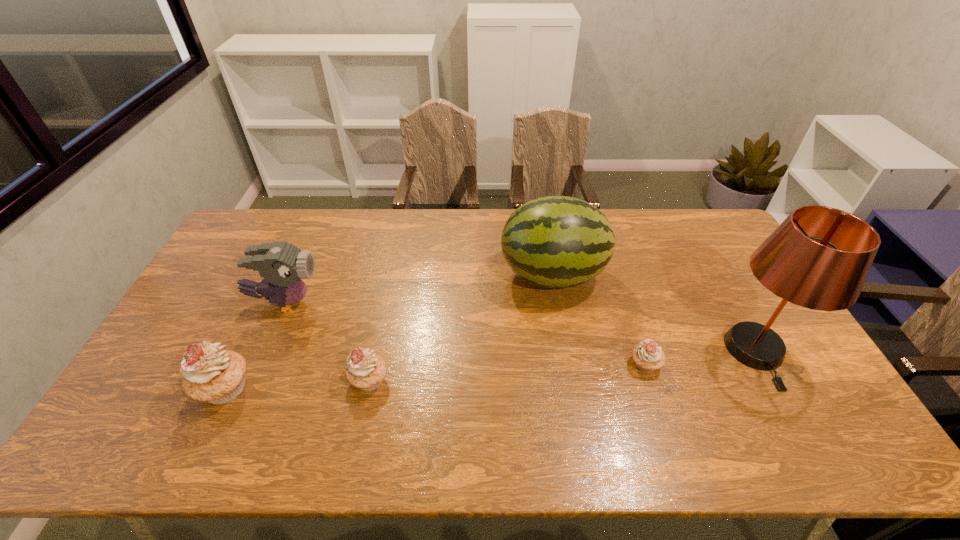
Locate which object ranks third in proximity to the tallest cupcake. Please provide its 2D coordinates. Your answer should be formatted as a tuple, i.e. [(x, y)], where the tuple contains the x and y coordinates of a point satisfying the conditions above.

[(554, 241)]

Select which object appears as the fifth closest to the fourth shortest object. Please provide its 2D coordinates. Your answer should be formatted as a tuple, i.e. [(x, y)], where the tuple contains the x and y coordinates of a point satisfying the conditions above.

[(819, 257)]

Find the location of a particular element. This screenshot has width=960, height=540. cupcake that can be found as the second closest to the rightmost cupcake is located at coordinates (210, 374).

Locate an element on the screen. cupcake that is the nearest to the fifth shortest object is located at coordinates (648, 356).

Where is `free space in the image that satisfies the following two spatial constraints: 1. at the stem end of the watermelon; 2. on the right side of the rightmost cupcake`? Image resolution: width=960 pixels, height=540 pixels. free space in the image that satisfies the following two spatial constraints: 1. at the stem end of the watermelon; 2. on the right side of the rightmost cupcake is located at coordinates (567, 364).

Identify the location of vacant position in the image that satisfies the following two spatial constraints: 1. on the back side of the second tallest cupcake; 2. at the beak of the fourth shortest object. This screenshot has width=960, height=540. (385, 302).

Where is `free space that satisfies the following two spatial constraints: 1. at the beak of the bird; 2. on the front side of the tallest cupcake`? free space that satisfies the following two spatial constraints: 1. at the beak of the bird; 2. on the front side of the tallest cupcake is located at coordinates (249, 388).

What are the coordinates of `free space that satisfies the following two spatial constraints: 1. at the stem end of the watermelon; 2. on the right side of the rightmost cupcake` in the screenshot? It's located at (567, 364).

Where is `vacant space that satisfies the following two spatial constraints: 1. at the beak of the second cupcake from left to right; 2. on the left side of the third tallest object`? vacant space that satisfies the following two spatial constraints: 1. at the beak of the second cupcake from left to right; 2. on the left side of the third tallest object is located at coordinates (252, 380).

At what (x,y) coordinates should I click in order to perform the action: click on vacant space that satisfies the following two spatial constraints: 1. at the beak of the shortest cupcake; 2. on the left side of the third tallest object. Please return your answer as a coordinate pair (x, y). Looking at the image, I should click on (259, 364).